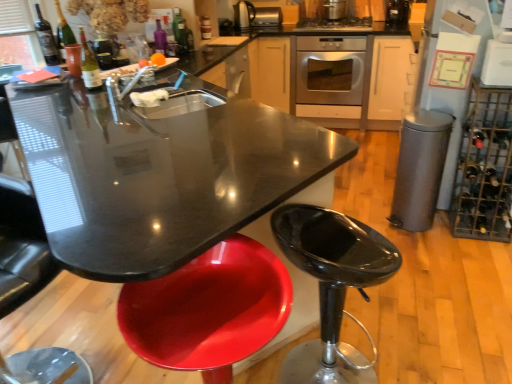
Question: Considering the relative positions of matte glass wine bottle at upper left, the 2th wine bottle in the front-to-back sequence, and metallic stainless steel toaster at upper center, which is counted as the first appliance, starting from the top, in the image provided, is matte glass wine bottle at upper left, the 2th wine bottle in the front-to-back sequence, to the right of metallic stainless steel toaster at upper center, which is counted as the first appliance, starting from the top, from the viewer's perspective?

Choices:
 (A) yes
 (B) no

Answer: (B)

Question: From a real-world perspective, does matte glass wine bottle at upper left, which is the second wine bottle from back to front, stand above metallic stainless steel toaster at upper center, which is the fourth appliance from right to left?

Choices:
 (A) no
 (B) yes

Answer: (B)

Question: Is metallic stainless steel toaster at upper center, which is the first appliance from back to front, completely or partially inside matte glass wine bottle at upper left, positioned as the second wine bottle in left-to-right order?

Choices:
 (A) no
 (B) yes

Answer: (A)

Question: Is there a large distance between matte glass wine bottle at upper left, the 2th wine bottle in the front-to-back sequence, and metallic stainless steel toaster at upper center, marked as the 2th appliance in a left-to-right arrangement?

Choices:
 (A) no
 (B) yes

Answer: (B)

Question: Can you confirm if matte glass wine bottle at upper left, positioned as the second wine bottle in left-to-right order, is smaller than metallic stainless steel toaster at upper center, marked as the 2th appliance in a left-to-right arrangement?

Choices:
 (A) yes
 (B) no

Answer: (A)

Question: Would you say matte black wine bottle at upper left, which ranks as the 3th wine bottle in right-to-left order, is to the left or to the right of metallic silver toaster at upper center, the 3th appliance in the bottom-to-top sequence, in the picture?

Choices:
 (A) left
 (B) right

Answer: (A)

Question: From the image's perspective, is matte black wine bottle at upper left, which ranks as the 3th wine bottle in right-to-left order, above or below metallic silver toaster at upper center, the third appliance in the top-to-bottom sequence?

Choices:
 (A) above
 (B) below

Answer: (B)

Question: Looking at their shapes, would you say matte black wine bottle at upper left, which is counted as the third wine bottle, starting from the back, is wider or thinner than metallic silver toaster at upper center, which ranks as the 3th appliance in back-to-front order?

Choices:
 (A) thin
 (B) wide

Answer: (A)

Question: Considering the positions of matte black wine bottle at upper left, which ranks as the 3th wine bottle in right-to-left order, and metallic silver toaster at upper center, which ranks as the 3th appliance in back-to-front order, in the image, is matte black wine bottle at upper left, which ranks as the 3th wine bottle in right-to-left order, bigger or smaller than metallic silver toaster at upper center, which ranks as the 3th appliance in back-to-front order,?

Choices:
 (A) small
 (B) big

Answer: (A)

Question: Considering the positions of glossy plastic bar stool at lower right and matte glass bottle at upper left, the first bottle positioned from the left, in the image, is glossy plastic bar stool at lower right wider or thinner than matte glass bottle at upper left, the first bottle positioned from the left,?

Choices:
 (A) thin
 (B) wide

Answer: (B)

Question: Is glossy plastic bar stool at lower right inside or outside of matte glass bottle at upper left, which is the 3th bottle in back-to-front order?

Choices:
 (A) outside
 (B) inside

Answer: (A)

Question: Considering their positions, is glossy plastic bar stool at lower right located in front of or behind matte glass bottle at upper left, which is the 3th bottle in back-to-front order?

Choices:
 (A) behind
 (B) front

Answer: (B)

Question: From a real-world perspective, relative to matte glass bottle at upper left, the first bottle positioned from the left, is glossy plastic bar stool at lower right vertically above or below?

Choices:
 (A) below
 (B) above

Answer: (A)

Question: Considering the positions of metallic wire wine rack at right and stainless steel oven at center in the image, is metallic wire wine rack at right taller or shorter than stainless steel oven at center?

Choices:
 (A) tall
 (B) short

Answer: (A)

Question: From a real-world perspective, relative to stainless steel oven at center, is metallic wire wine rack at right vertically above or below?

Choices:
 (A) above
 (B) below

Answer: (B)